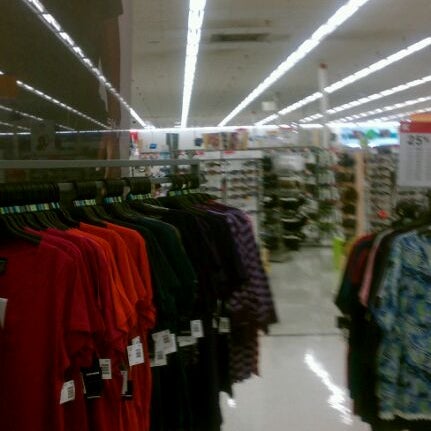
Locate an element on the screen. The width and height of the screenshot is (431, 431). floor is located at coordinates 282,363.